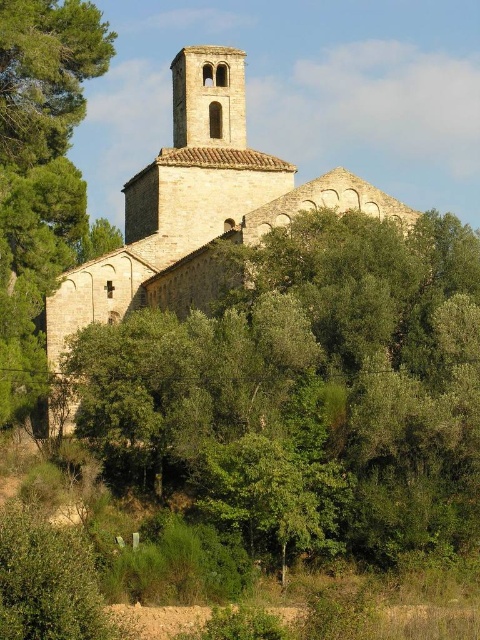
You are standing in front of the historic stone church and notice a green leafy tree at center and a stone church at center. Which object is closer to you?

The green leafy tree at center is closer to you since it is in front of the stone church at center.

You are standing at the entrance of the historic stone church and want to walk towards the point marked as point (379, 243). As you walk, you notice another point labeled point (80, 109). Which point will you encounter first?

You will encounter point (379, 243) first because it is in front of point (80, 109) from your current position at the entrance.